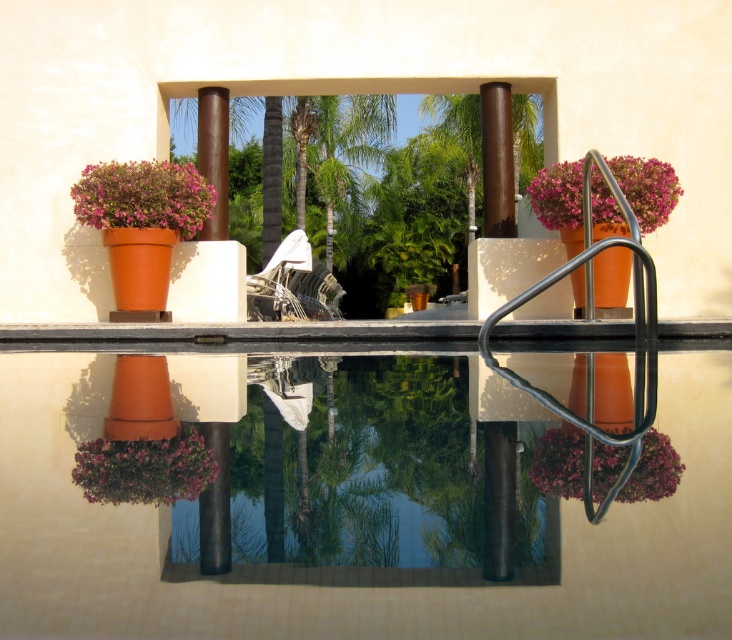
Is transparent glass water at center shorter than purple matte flower pot at lower left?

No, transparent glass water at center is not shorter than purple matte flower pot at lower left.

Who is more distant from viewer, (496, 568) or (190, 484)?

Point (190, 484)

Who is more forward, (244, 401) or (157, 452)?

Point (157, 452)

The height and width of the screenshot is (640, 732). I want to click on transparent glass water at center, so click(370, 476).

Identify the location of matte terracotta pot at left. This screenshot has width=732, height=640. (143, 196).

Does matte terracotta pot at left appear on the right side of purple matte flower pot at lower left?

In fact, matte terracotta pot at left is to the left of purple matte flower pot at lower left.

Does point (132, 221) come in front of point (111, 476)?

No, (132, 221) is behind (111, 476).

Identify the location of matte terracotta pot at left. (143, 196).

Between point (534, 186) and point (668, 460), which one is positioned behind?

The point (534, 186) is behind.

Image resolution: width=732 pixels, height=640 pixels. Find the location of `matte terracotta pot at right`. matte terracotta pot at right is located at coordinates (646, 188).